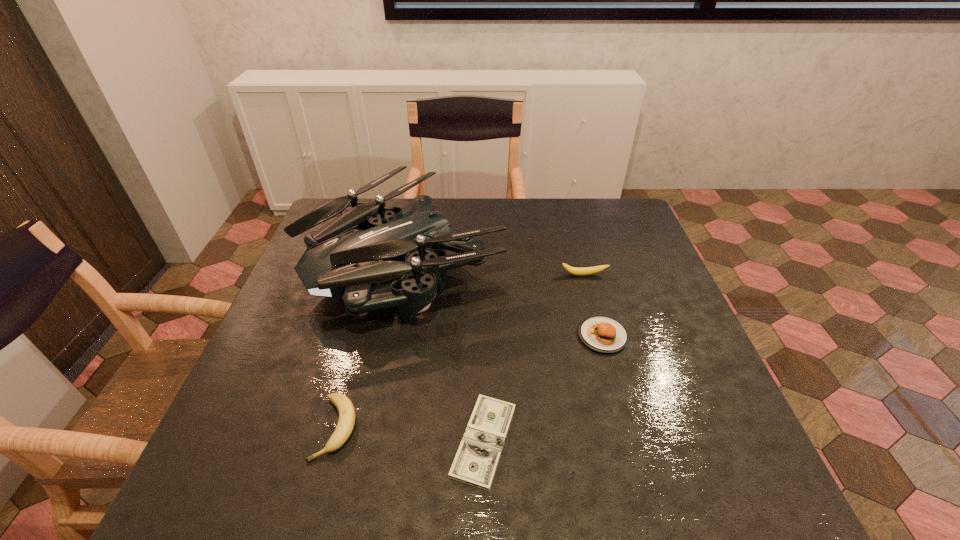
At what (x,y) coordinates should I click in order to perform the action: click on drone. Please return your answer as a coordinate pair (x, y). The image size is (960, 540). Looking at the image, I should click on (366, 244).

The height and width of the screenshot is (540, 960). In order to click on the farther banana in this screenshot , I will do `click(584, 271)`.

Where is `the taller banana`? The width and height of the screenshot is (960, 540). the taller banana is located at coordinates (584, 271).

Where is `food`? The width and height of the screenshot is (960, 540). food is located at coordinates (601, 334).

Image resolution: width=960 pixels, height=540 pixels. What are the coordinates of `the shorter banana` in the screenshot? It's located at (346, 410).

Locate an element on the screen. the second shortest object is located at coordinates (346, 410).

Locate an element on the screen. This screenshot has width=960, height=540. dollar is located at coordinates (475, 463).

Image resolution: width=960 pixels, height=540 pixels. I want to click on free space located 0.280m on the right of the tallest object, so click(x=601, y=264).

Identify the location of vacant space located 0.100m on the upward curve of the taller banana. The width and height of the screenshot is (960, 540). (590, 303).

At what (x,y) coordinates should I click in order to perform the action: click on vacant position located 0.190m on the left of the food. Please return your answer as a coordinate pair (x, y). The image size is (960, 540). Looking at the image, I should click on (499, 336).